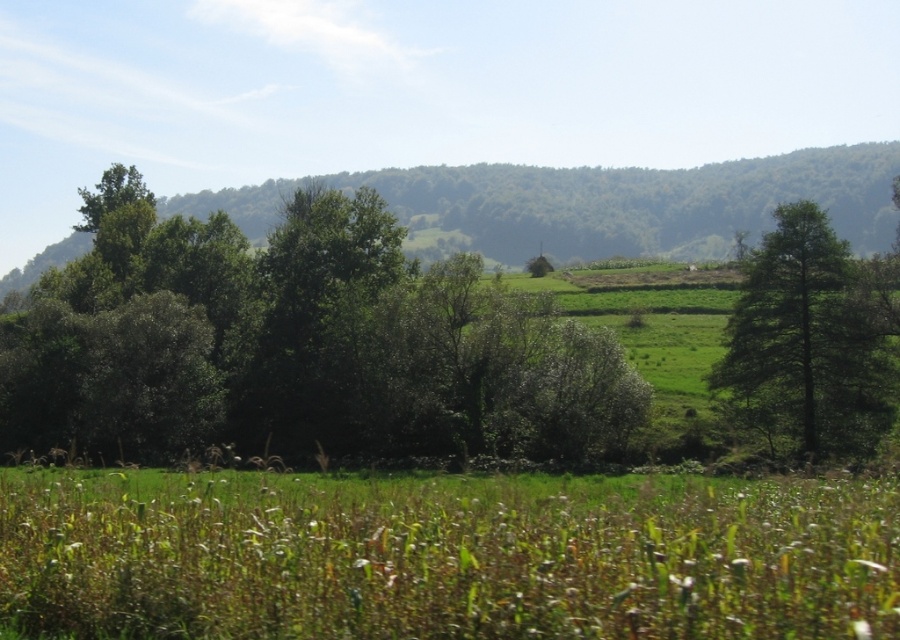
You are standing at the edge of the green grassy pasture at lower center and want to reach the green leafy tree at center. Which direction should you move to get closer to the tree?

To reach the green leafy tree at center from the green grassy pasture at lower center, you should move upward since the pasture is located below the tree.

You are standing at the origin point in the image. Which direction should you walk to reach the green grassy pasture at lower center?

You should walk towards the lower center direction to reach the green grassy pasture at lower center, as it is located at point (446, 561).

You are standing in the middle of the green grassy pasture at lower center and want to walk towards the green leafy tree at right. Which direction should you head?

You should head to the right because the green grassy pasture at lower center is to the left of green leafy tree at right.